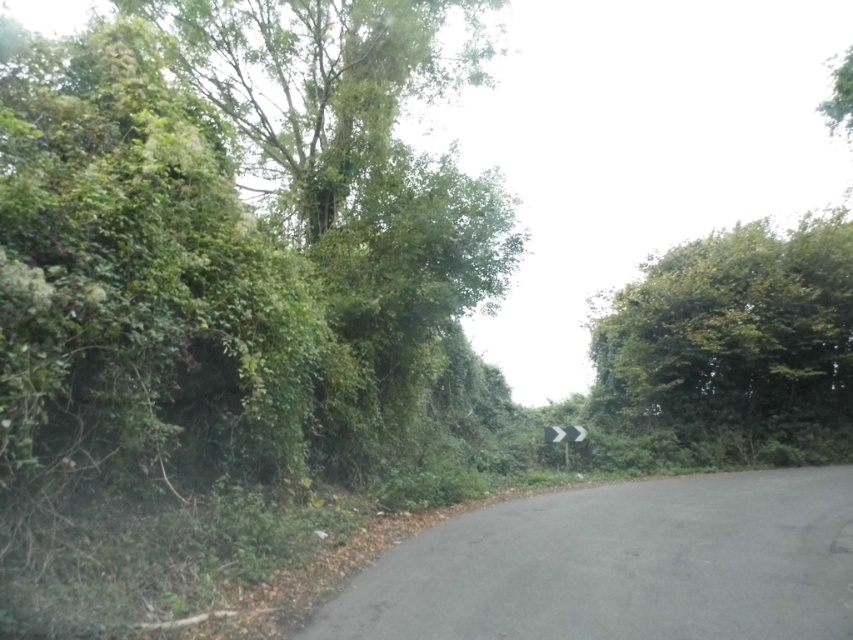
Question: Does green leafy tree at upper left lie behind white plastic sign at center?

Choices:
 (A) yes
 (B) no

Answer: (B)

Question: Based on their relative distances, which object is farther from the green leafy tree at right?

Choices:
 (A) white plastic sign at center
 (B) green leafy tree at upper left

Answer: (B)

Question: Which point is closer to the camera taking this photo?

Choices:
 (A) coord(670,372)
 (B) coord(346,177)
 (C) coord(549,433)

Answer: (B)

Question: Which object is the closest to the green leafy tree at right?

Choices:
 (A) white plastic sign at center
 (B) green leafy tree at upper left

Answer: (A)

Question: Can you confirm if green leafy tree at right is positioned below white plastic sign at center?

Choices:
 (A) no
 (B) yes

Answer: (B)

Question: Can you confirm if green leafy tree at right is positioned to the left of white plastic sign at center?

Choices:
 (A) no
 (B) yes

Answer: (A)